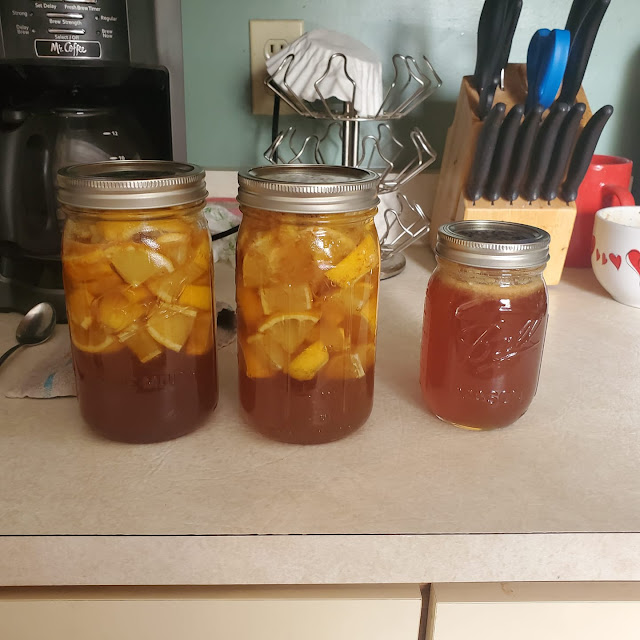
Find the location of a particular element. counter is located at coordinates (236, 460).